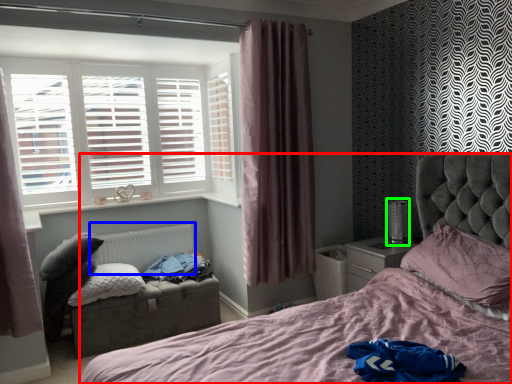
Question: Estimate the real-world distances between objects in this image. Which object is farther from bed (highlighted by a red box), radiator (highlighted by a blue box) or table lamp (highlighted by a green box)?

Choices:
 (A) radiator
 (B) table lamp

Answer: (A)